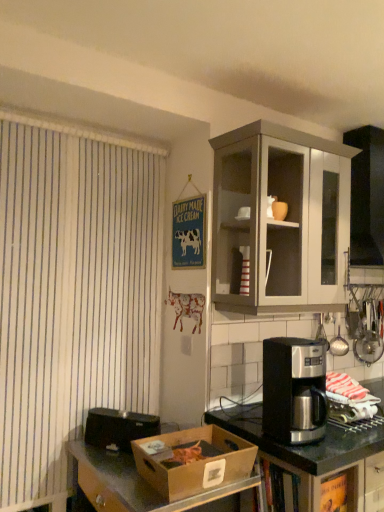
Question: Is matte ceramic cup at upper center not close to brown cardboard box at lower left?

Choices:
 (A) no
 (B) yes

Answer: (B)

Question: Does matte ceramic cup at upper center appear on the left side of brown cardboard box at lower left?

Choices:
 (A) no
 (B) yes

Answer: (A)

Question: Considering the relative sizes of matte ceramic cup at upper center and brown cardboard box at lower left in the image provided, is matte ceramic cup at upper center taller than brown cardboard box at lower left?

Choices:
 (A) no
 (B) yes

Answer: (A)

Question: From a real-world perspective, is matte ceramic cup at upper center located beneath brown cardboard box at lower left?

Choices:
 (A) yes
 (B) no

Answer: (B)

Question: Considering the relative sizes of matte ceramic cup at upper center and brown cardboard box at lower left in the image provided, is matte ceramic cup at upper center thinner than brown cardboard box at lower left?

Choices:
 (A) no
 (B) yes

Answer: (B)

Question: Does point (273, 206) appear closer or farther from the camera than point (246, 500)?

Choices:
 (A) farther
 (B) closer

Answer: (A)

Question: Is matte ceramic cup at upper center taller or shorter than brown cardboard box at lower left?

Choices:
 (A) short
 (B) tall

Answer: (A)

Question: Considering the positions of matte ceramic cup at upper center and brown cardboard box at lower left in the image, is matte ceramic cup at upper center wider or thinner than brown cardboard box at lower left?

Choices:
 (A) thin
 (B) wide

Answer: (A)

Question: Choose the correct answer: Is matte ceramic cup at upper center inside brown cardboard box at lower left or outside it?

Choices:
 (A) outside
 (B) inside

Answer: (A)

Question: Is white striped curtain at left in front of or behind matte ceramic cup at upper center in the image?

Choices:
 (A) behind
 (B) front

Answer: (B)

Question: From the image's perspective, relative to matte ceramic cup at upper center, is white striped curtain at left above or below?

Choices:
 (A) above
 (B) below

Answer: (B)

Question: Considering the positions of white striped curtain at left and matte ceramic cup at upper center in the image, is white striped curtain at left taller or shorter than matte ceramic cup at upper center?

Choices:
 (A) short
 (B) tall

Answer: (B)

Question: Based on their positions, is white striped curtain at left located to the left or right of matte ceramic cup at upper center?

Choices:
 (A) left
 (B) right

Answer: (A)

Question: From a real-world perspective, is stainless steel coffee maker at right positioned above or below matte gray cabinet at upper right?

Choices:
 (A) below
 (B) above

Answer: (A)

Question: Is stainless steel coffee maker at right inside or outside of matte gray cabinet at upper right?

Choices:
 (A) outside
 (B) inside

Answer: (A)